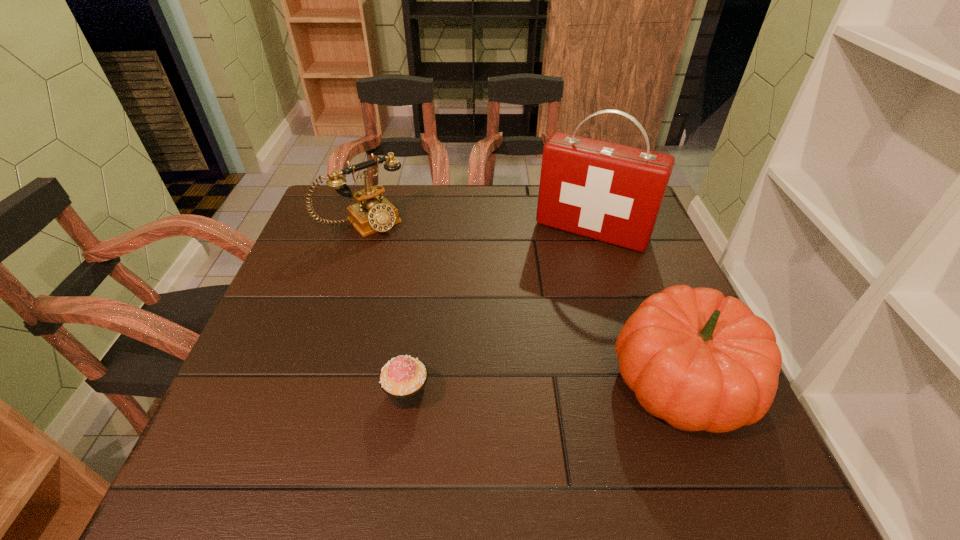
You are a GUI agent. You are given a task and a screenshot of the screen. Output one action in this format:
    pyautogui.click(x=<x>, y=<y>)
    Task: Click on the object that is at the far left corner
    
    Given the screenshot: What is the action you would take?
    pyautogui.click(x=372, y=213)

Locate an element on the screen. object that is at the far right corner is located at coordinates (609, 192).

This screenshot has width=960, height=540. I want to click on object present at the near right corner, so click(x=698, y=360).

In the image, there is a desktop. In order to click on vacant area at the far edge in this screenshot , I will do `click(426, 195)`.

In the image, there is a desktop. At what (x,y) coordinates should I click in order to perform the action: click on vacant space at the near edge. Please return your answer as a coordinate pair (x, y). The image size is (960, 540). Looking at the image, I should click on (554, 430).

Identify the location of free spot at the left edge of the desktop. The width and height of the screenshot is (960, 540). (294, 383).

In the image, there is a desktop. Where is `vacant space at the right edge`? vacant space at the right edge is located at coordinates (658, 265).

In the image, there is a desktop. What are the coordinates of `free space at the far left corner` in the screenshot? It's located at (342, 198).

Where is `vacant area between the pumpkin and the tallest object`? The width and height of the screenshot is (960, 540). vacant area between the pumpkin and the tallest object is located at coordinates (636, 305).

Locate an element on the screen. The image size is (960, 540). empty space that is in between the cupcake and the leftmost object is located at coordinates (386, 308).